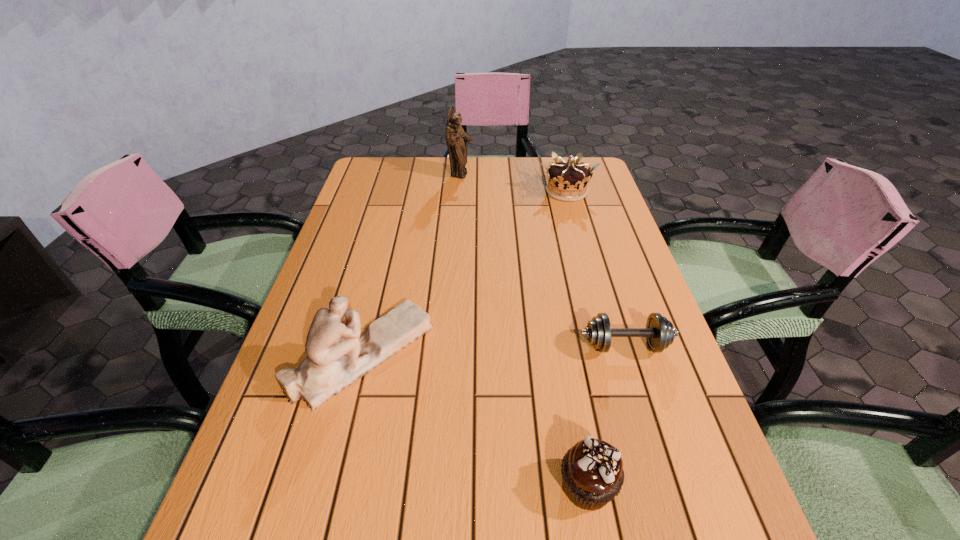
You are a GUI agent. You are given a task and a screenshot of the screen. Output one action in this format:
    pyautogui.click(x=<x>, y=<y>)
    Task: Click on the tallest object
    Image resolution: width=960 pixels, height=540 pixels.
    Given the screenshot: What is the action you would take?
    pyautogui.click(x=456, y=138)

Where is `the farther figurine`? the farther figurine is located at coordinates (456, 138).

At what (x,y) coordinates should I click in order to perform the action: click on the nearer figurine. Please return your answer as a coordinate pair (x, y). This screenshot has width=960, height=540. Looking at the image, I should click on (337, 355).

At what (x,y) coordinates should I click in order to perform the action: click on the shorter figurine. Please return your answer as a coordinate pair (x, y). The height and width of the screenshot is (540, 960). Looking at the image, I should click on (337, 355).

The image size is (960, 540). Find the location of `the third tallest object`. the third tallest object is located at coordinates coord(567,181).

Image resolution: width=960 pixels, height=540 pixels. Identify the location of cupcake. (592, 471).

Image resolution: width=960 pixels, height=540 pixels. In order to click on the nearest object in this screenshot , I will do `click(592, 471)`.

At what (x,y) coordinates should I click in order to perform the action: click on dumbbell. Please return your answer as a coordinate pair (x, y). This screenshot has height=540, width=960. Looking at the image, I should click on (659, 332).

Find the location of `vacant region located 0.100m on the front-facing side of the tallest object`. vacant region located 0.100m on the front-facing side of the tallest object is located at coordinates pyautogui.click(x=504, y=175).

Identify the location of blank area located 0.400m on the front-facing side of the shorter figurine. This screenshot has width=960, height=540. (x=620, y=354).